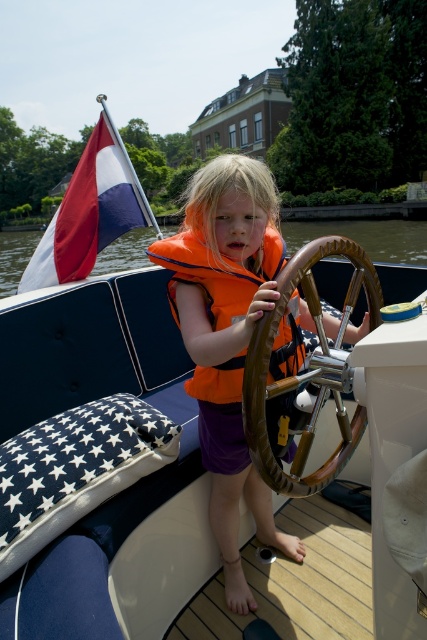
Is point (245, 256) farther from camera compared to point (102, 132)?

No, it is in front of (102, 132).

Which is in front, point (225, 460) or point (93, 236)?

Point (225, 460) is more forward.

At what (x,y) coordinates should I click in order to perform the action: click on orange life vest at center. Please return your answer as a coordinate pair (x, y). The width and height of the screenshot is (427, 640). Looking at the image, I should click on (227, 337).

Can you confirm if brown leather steering wheel at center is positioned to the right of red-white-blue fabric flag at upper left?

Indeed, brown leather steering wheel at center is positioned on the right side of red-white-blue fabric flag at upper left.

Does brown leather steering wheel at center have a smaller size compared to red-white-blue fabric flag at upper left?

Yes.

Between point (269, 358) and point (142, 225), which one is positioned behind?

The point (142, 225) is behind.

You are a GUI agent. You are given a task and a screenshot of the screen. Output one action in this format:
    pyautogui.click(x=<x>, y=<y>)
    Task: Click on the brown leather steering wheel at center
    
    Given the screenshot: What is the action you would take?
    [x=307, y=369]

Does point (111, 193) lie in front of point (286, 326)?

No, it is behind (286, 326).

Can you confirm if red-white-blue fabric flag at upper left is thinner than orange life jacket at center?

Incorrect, red-white-blue fabric flag at upper left's width is not less than orange life jacket at center's.

Which is in front, point (99, 243) or point (213, 280)?

Positioned in front is point (213, 280).

You are a GUI agent. You are given a task and a screenshot of the screen. Output one action in this format:
    pyautogui.click(x=<x>, y=<y>)
    Task: Click on the red-white-blue fabric flag at upper left
    The width and height of the screenshot is (427, 640).
    Given the screenshot: What is the action you would take?
    pyautogui.click(x=90, y=211)